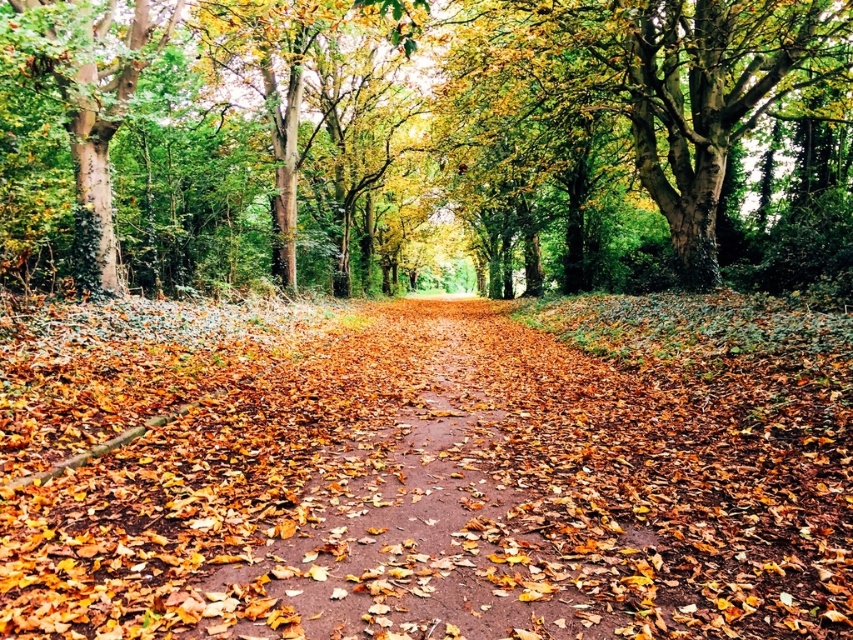
You are standing on the brown dirt path at center and want to walk towards the green rough bark tree at left. Is the tree closer or farther away from you?

The green rough bark tree at left is farther away from you because the brown dirt path at center is closer to the viewer than the tree.